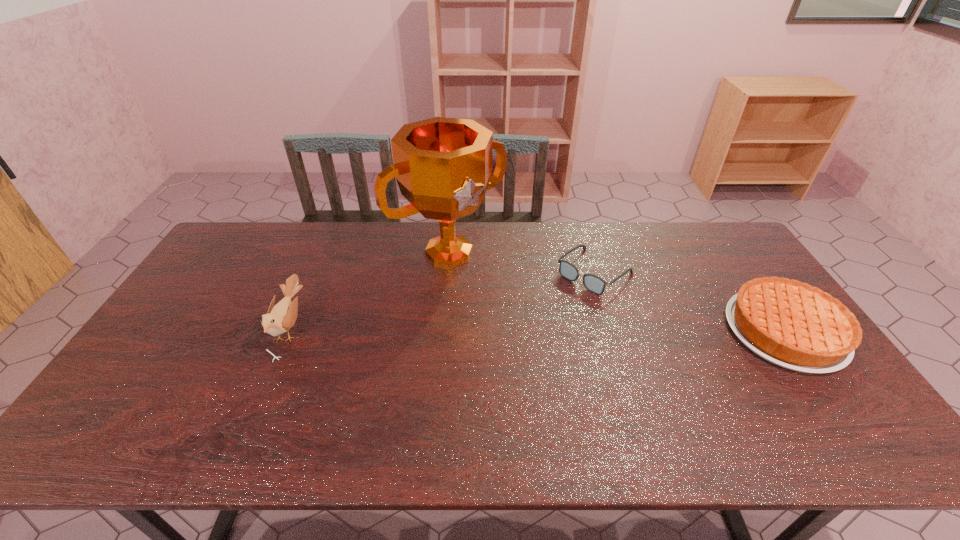
The height and width of the screenshot is (540, 960). Find the location of `the second tallest object`. the second tallest object is located at coordinates (280, 318).

Locate an element on the screen. This screenshot has height=540, width=960. the leftmost object is located at coordinates (280, 318).

This screenshot has height=540, width=960. Find the location of `the rightmost object`. the rightmost object is located at coordinates (794, 325).

I want to click on spectacles, so click(593, 283).

Identify the location of the shortest object. (593, 283).

Where is `the tallest object`? the tallest object is located at coordinates (443, 166).

Locate an element on the screen. The width and height of the screenshot is (960, 540). the third object from right to left is located at coordinates (443, 166).

Identify the location of vacant space located at the beak of the third shortest object. (255, 328).

You are a GUI agent. You are given a task and a screenshot of the screen. Output one action in this format:
    pyautogui.click(x=<x>, y=<y>)
    Task: Click on the vacant region located at the beak of the third shortest object
    The image size is (960, 540).
    Given the screenshot: What is the action you would take?
    pyautogui.click(x=255, y=328)

Locate an element on the screen. free space located 0.220m at the beak of the third shortest object is located at coordinates 200,328.